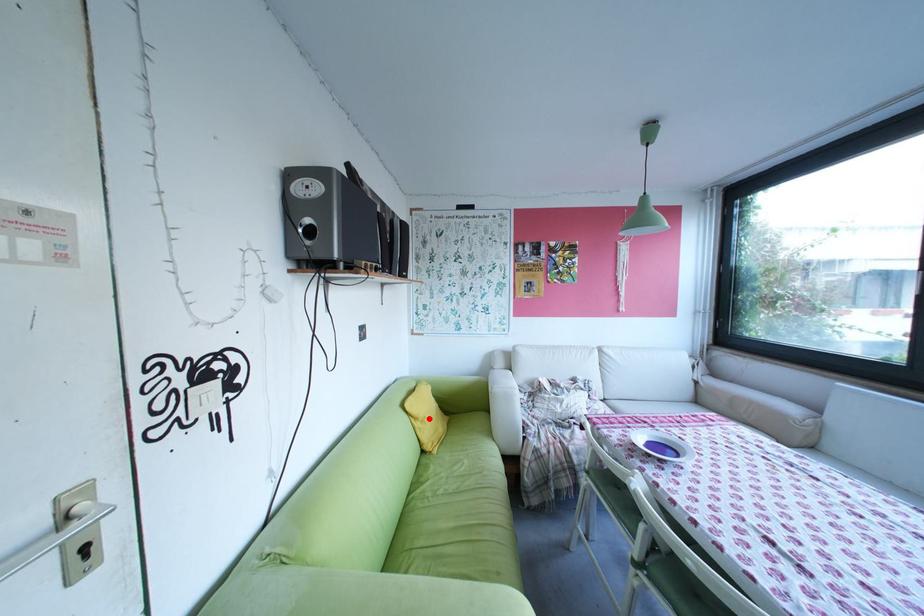
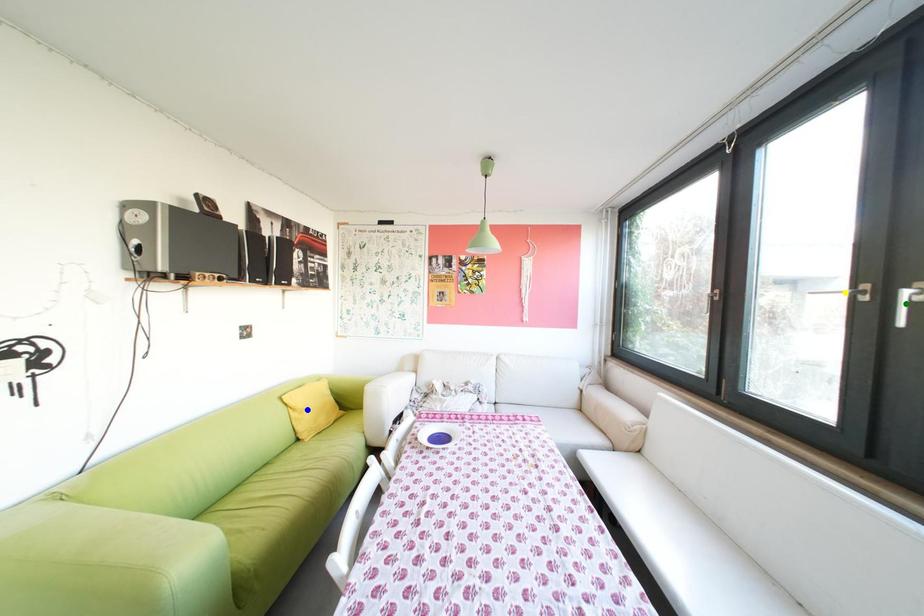
Question: I am providing you with two images of the same scene from different viewpoints. A red point is marked on the first image. You are given multiple points on the second image. Which point in image 2 is actually the same real-world point as the red point in image 1?

Choices:
 (A) yellow point
 (B) green point
 (C) blue point

Answer: (C)